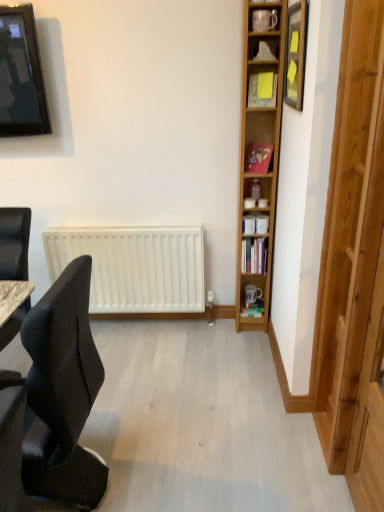
This screenshot has width=384, height=512. What do you see at coordinates (350, 229) in the screenshot?
I see `transparent wooden door at right` at bounding box center [350, 229].

The width and height of the screenshot is (384, 512). Identify the location of hardcover book at center. click(x=254, y=255).

Identify the location of shelf on the left side of hardcover book at center. The width and height of the screenshot is (384, 512). (262, 89).

Considering the sizes of objects hardcover book at center and yellow paper at upper center in the image provided, who is shorter, hardcover book at center or yellow paper at upper center?

yellow paper at upper center is shorter.

How different are the orientations of hardcover book at center and yellow paper at upper center in degrees?

The facing directions of hardcover book at center and yellow paper at upper center are 9.74 degrees apart.

From the image's perspective, which one is positioned lower, hardcover book at center or yellow paper at upper center?

From the image's view, hardcover book at center is below.

From the image's perspective, is black fabric chair at left above or below yellow paper at upper center?

black fabric chair at left is below yellow paper at upper center.

Considering the positions of objects black fabric chair at left and yellow paper at upper center in the image provided, who is behind, black fabric chair at left or yellow paper at upper center?

yellow paper at upper center is further away from the camera.

Is black fabric chair at left taller or shorter than yellow paper at upper center?

Clearly, black fabric chair at left is taller compared to yellow paper at upper center.

Could you tell me if black fabric chair at left is turned towards yellow paper at upper center?

No, black fabric chair at left is not aimed at yellow paper at upper center.

From a real-world perspective, is wooden bookcase at right on black fabric chair at left?

Yes, from a real-world perspective, wooden bookcase at right is on top of black fabric chair at left.

Considering the positions of points (243, 25) and (85, 460), is point (243, 25) closer to camera compared to point (85, 460)?

No, it is not.

Which object is positioned more to the left, wooden bookcase at right or black fabric chair at left?

black fabric chair at left.

In terms of width, does wooden bookcase at right look wider or thinner when compared to black fabric chair at left?

Considering their sizes, wooden bookcase at right looks slimmer than black fabric chair at left.

How different are the orientations of hardcover book at center and matte black television at upper left in degrees?

4.74 degrees separate the facing orientations of hardcover book at center and matte black television at upper left.

Can you confirm if hardcover book at center is positioned to the left of matte black television at upper left?

No.

From the picture: From the image's perspective, would you say hardcover book at center is shown under matte black television at upper left?

Correct, hardcover book at center appears lower than matte black television at upper left in the image.

This screenshot has width=384, height=512. In order to click on television in front of the hardcover book at center in this screenshot , I will do `click(21, 75)`.

Can you tell me how much yellow paper at upper center and wooden picture frame at upper right differ in facing direction?

The angular difference between yellow paper at upper center and wooden picture frame at upper right is 73.4 degrees.

Based on the photo, is yellow paper at upper center not inside wooden picture frame at upper right?

That's correct, yellow paper at upper center is outside of wooden picture frame at upper right.

Based on their positions, is yellow paper at upper center located to the left or right of wooden picture frame at upper right?

In the image, yellow paper at upper center appears on the left side of wooden picture frame at upper right.

Between yellow paper at upper center and wooden picture frame at upper right, which one has more height?

With more height is wooden picture frame at upper right.

Is hardcover book at center next to wooden picture frame at upper right and touching it?

No, hardcover book at center is not next to wooden picture frame at upper right.

Considering the relative sizes of hardcover book at center and wooden picture frame at upper right in the image provided, is hardcover book at center taller than wooden picture frame at upper right?

Incorrect, the height of hardcover book at center is not larger of that of wooden picture frame at upper right.

Which is in front, point (258, 245) or point (304, 57)?

The point (304, 57) is closer.

Can we say hardcover book at center lies outside wooden picture frame at upper right?

Indeed, hardcover book at center is completely outside wooden picture frame at upper right.

From a real-world perspective, which object rests below the other?

yellow paper at upper center, from a real-world perspective.

Considering the relative sizes of matte black television at upper left and yellow paper at upper center in the image provided, is matte black television at upper left taller than yellow paper at upper center?

Yes, matte black television at upper left is taller than yellow paper at upper center.

Is matte black television at upper left next to yellow paper at upper center?

matte black television at upper left and yellow paper at upper center are clearly separated.

There is a hardcover book at center. Where is `shelf above it (from a real-world perspective)`? The width and height of the screenshot is (384, 512). shelf above it (from a real-world perspective) is located at coordinates (262, 89).

Where is `shelf behind the black fabric chair at left`? shelf behind the black fabric chair at left is located at coordinates (262, 89).

Based on their spatial positions, is hardcover book at center or black fabric chair at left further from transparent wooden door at right?

The object further to transparent wooden door at right is black fabric chair at left.

From the image, which object appears to be farther from transparent wooden door at right, black fabric chair at left or yellow paper at upper center?

The object further to transparent wooden door at right is black fabric chair at left.

Considering their positions, is hardcover book at center positioned further to wooden bookcase at right than wooden picture frame at upper right?

The object further to wooden bookcase at right is hardcover book at center.

Estimate the real-world distances between objects in this image. Which object is closer to yellow paper at upper center, matte black television at upper left or transparent wooden door at right?

The object closer to yellow paper at upper center is transparent wooden door at right.

Estimate the real-world distances between objects in this image. Which object is further from hardcover book at center, black fabric chair at left or wooden bookcase at right?

The object further to hardcover book at center is black fabric chair at left.

When comparing their distances from black fabric chair at left, does yellow paper at upper center or transparent wooden door at right seem further?

The object further to black fabric chair at left is yellow paper at upper center.

Estimate the real-world distances between objects in this image. Which object is closer to hardcover book at center, yellow paper at upper center or transparent wooden door at right?

Among the two, yellow paper at upper center is located nearer to hardcover book at center.

Estimate the real-world distances between objects in this image. Which object is further from wooden picture frame at upper right, black fabric chair at left or transparent wooden door at right?

black fabric chair at left is positioned further to the anchor wooden picture frame at upper right.

You are a GUI agent. You are given a task and a screenshot of the screen. Output one action in this format:
    pyautogui.click(x=<x>, y=<y>)
    Task: Click on the bookcase that lies between matte black television at upper left and black fabric chair at left from top to bottom
    
    Given the screenshot: What is the action you would take?
    pyautogui.click(x=258, y=142)

Identify the location of bookcase situated between matte black television at upper left and wooden picture frame at upper right from left to right. (258, 142).

Find the location of a particular element. The image size is (384, 512). picture frame between transparent wooden door at right and yellow paper at upper center from front to back is located at coordinates (295, 54).

The image size is (384, 512). I want to click on shelf positioned between transparent wooden door at right and hardcover book at center from near to far, so click(262, 89).